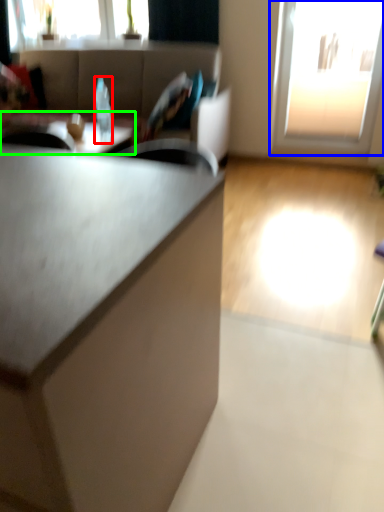
Question: Estimate the real-world distances between objects in this image. Which object is farther from bottle (highlighted by a red box), window (highlighted by a blue box) or table (highlighted by a green box)?

Choices:
 (A) window
 (B) table

Answer: (A)